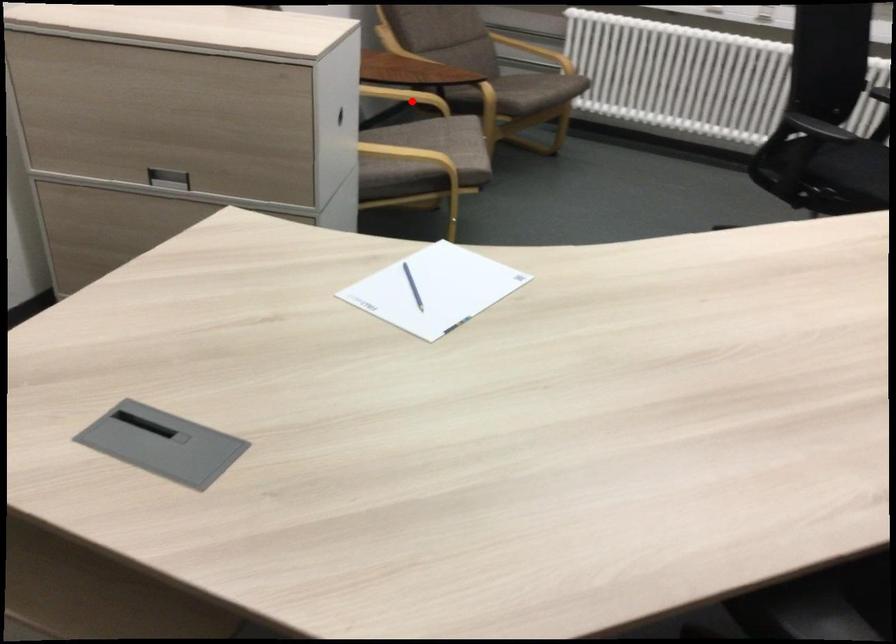
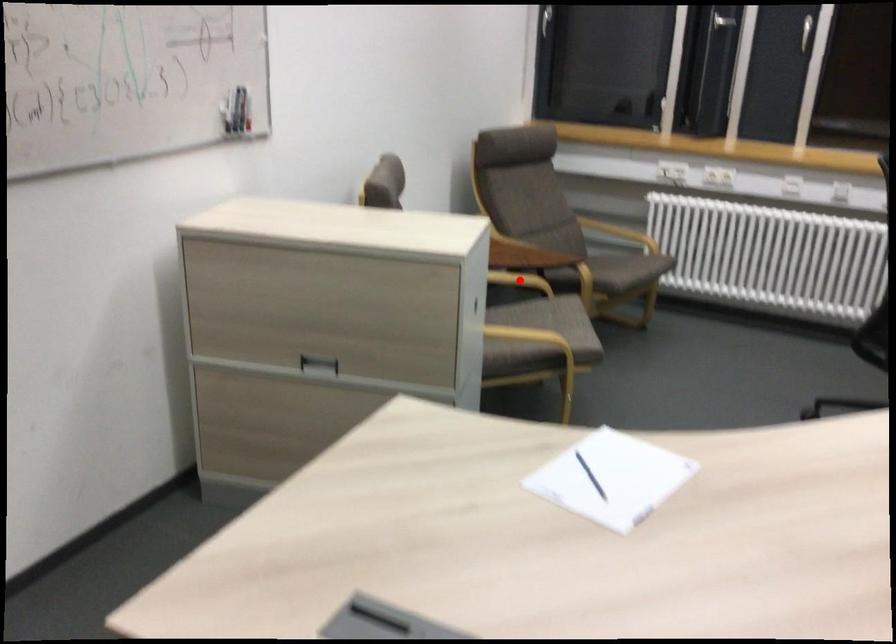
I am providing you with two images of the same scene from different viewpoints. A red point is marked on the first image and another point is marked on the second image. Is the red point in image1 aligned with the point shown in image2?

Yes